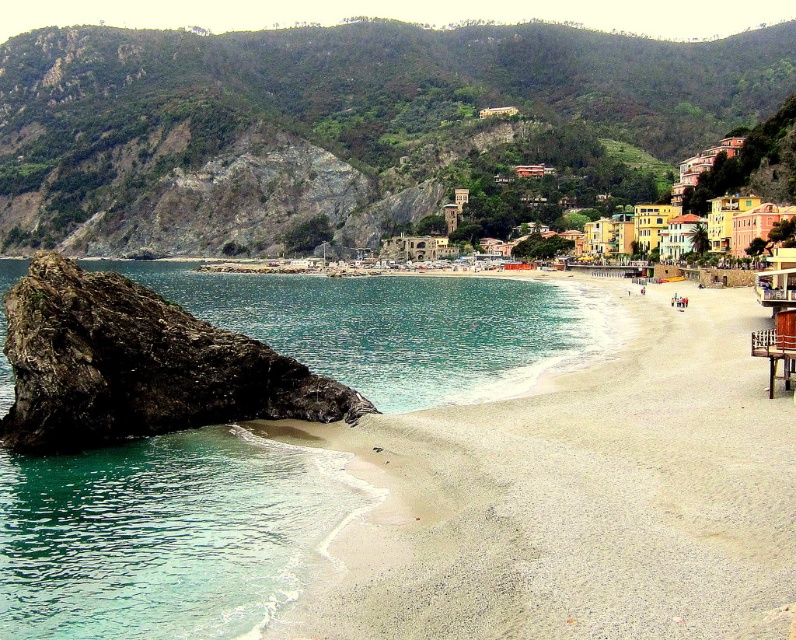
Which is above, green rocky hillside at upper center or white sandy beach at lower left?

green rocky hillside at upper center is higher up.

Who is positioned more to the right, green rocky hillside at upper center or white sandy beach at lower left?

Positioned to the right is white sandy beach at lower left.

Image resolution: width=796 pixels, height=640 pixels. Describe the element at coordinates (326, 120) in the screenshot. I see `green rocky hillside at upper center` at that location.

At what (x,y) coordinates should I click in order to perform the action: click on green rocky hillside at upper center. Please return your answer as a coordinate pair (x, y). Looking at the image, I should click on (326, 120).